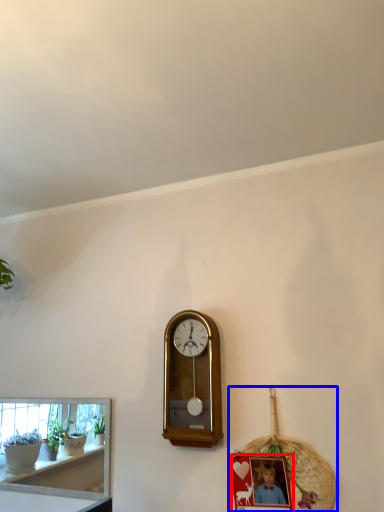
Question: Which object appears closest to the camera in this image, picture frame (highlighted by a red box) or basket (highlighted by a blue box)?

Choices:
 (A) picture frame
 (B) basket

Answer: (A)